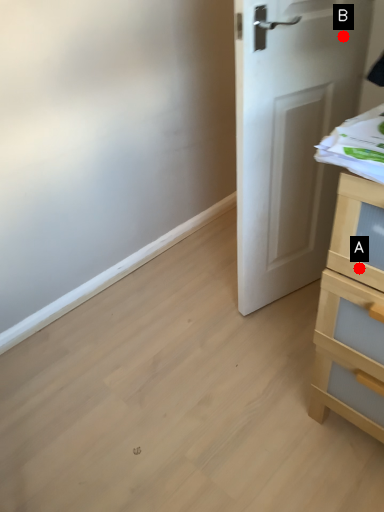
Question: Two points are circled on the image, labeled by A and B beside each circle. Which point is closer to the camera?

Choices:
 (A) A is closer
 (B) B is closer

Answer: (A)